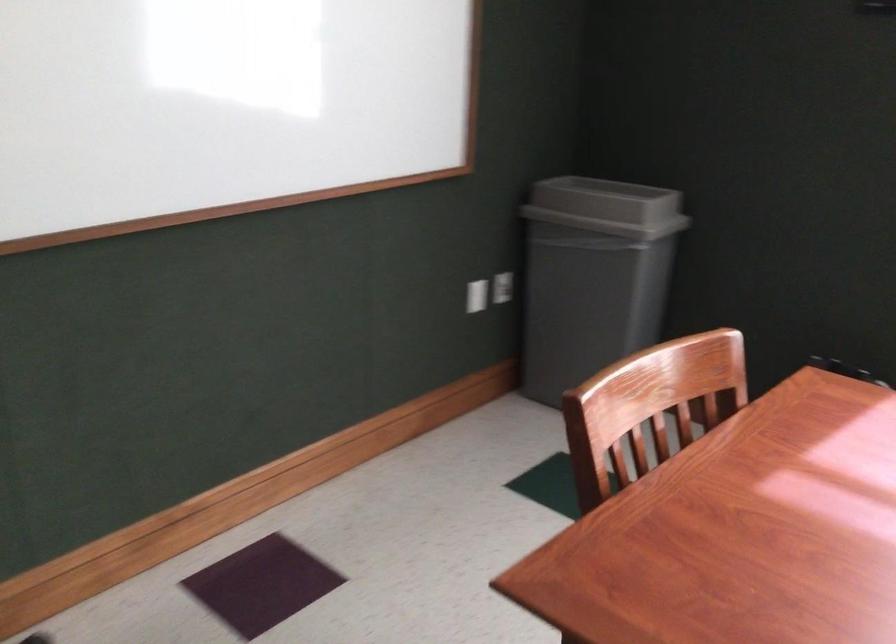
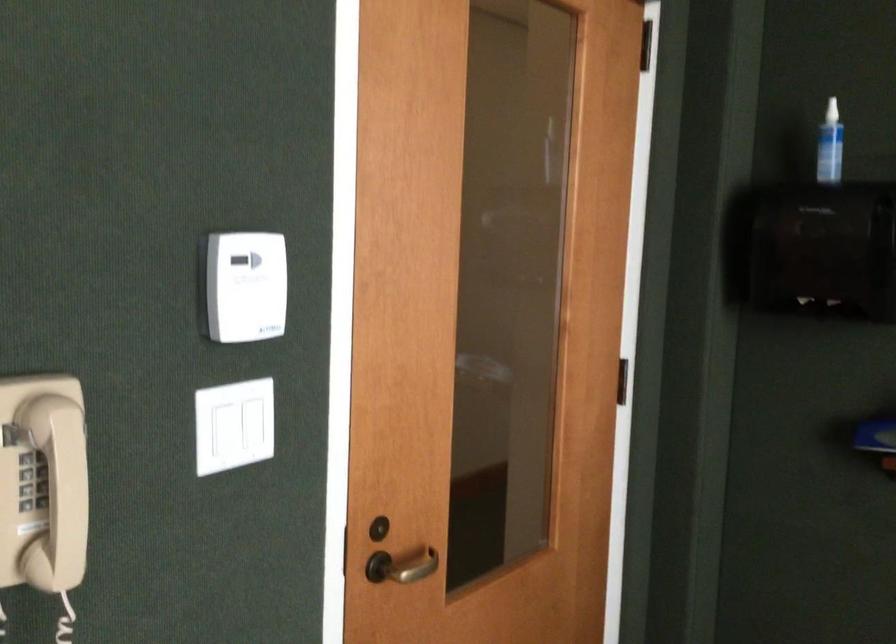
Question: The camera is either moving clockwise (left) or counter-clockwise (right) around the object. The first image is from the beginning of the video and the second image is from the end. Is the camera moving left or right when shooting the video?

Choices:
 (A) Left
 (B) Right

Answer: (B)